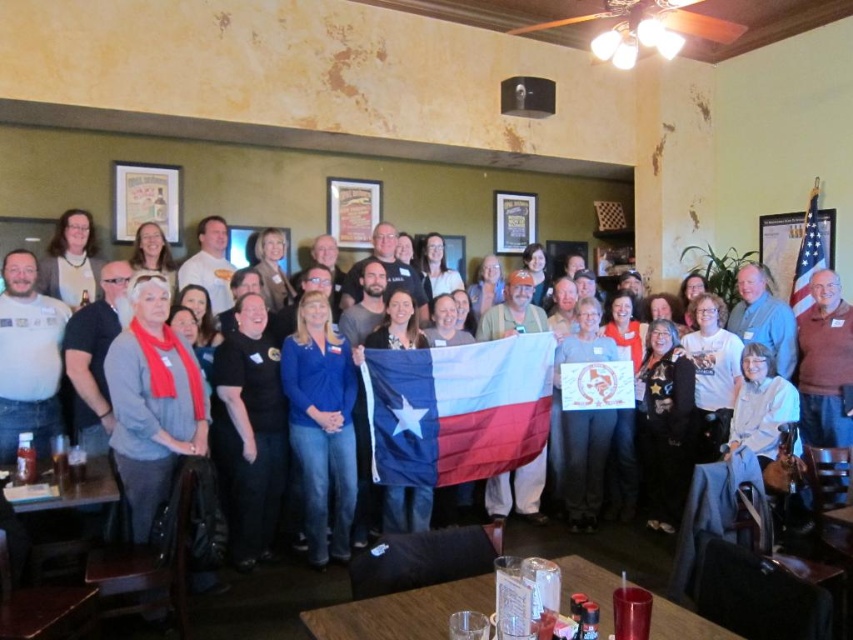
Question: Which point is farther to the camera?

Choices:
 (A) (525, 426)
 (B) (795, 292)

Answer: (B)

Question: Does polyester texas flag at center have a smaller size compared to american flag at upper right?

Choices:
 (A) no
 (B) yes

Answer: (A)

Question: Does polyester texas flag at center have a greater width compared to american flag at upper right?

Choices:
 (A) yes
 (B) no

Answer: (A)

Question: Which point appears closest to the camera in this image?

Choices:
 (A) (807, 307)
 (B) (381, 436)

Answer: (B)

Question: Does polyester texas flag at center lie in front of american flag at upper right?

Choices:
 (A) yes
 (B) no

Answer: (A)